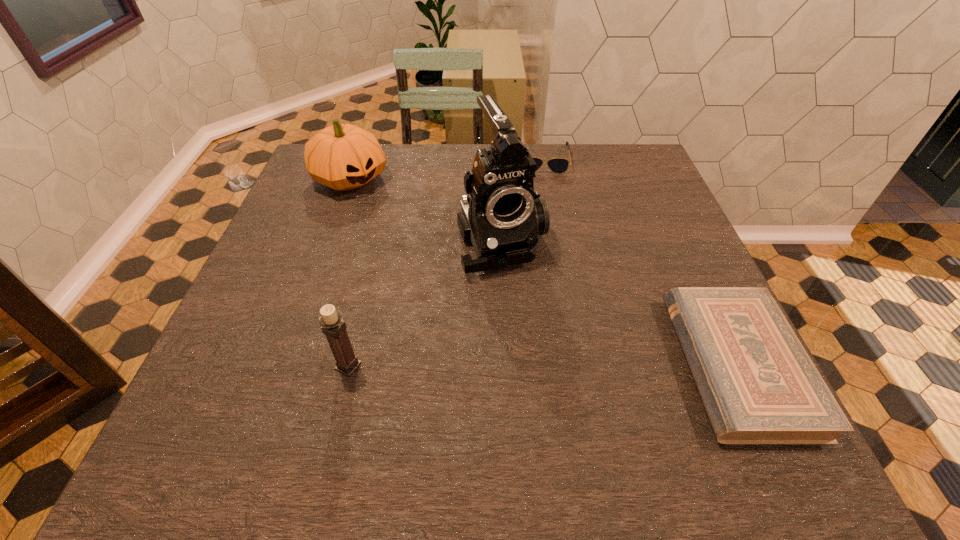
Locate an element on the screen. free spot on the desktop that is between the candle holder and the Bible and is positioned on the lens mount of the third farthest object is located at coordinates (562, 365).

Locate an element on the screen. The image size is (960, 540). free space on the desktop that is between the candle holder and the rightmost object and is positioned on the side of the gourd with the carved face is located at coordinates tap(561, 365).

The image size is (960, 540). Identify the location of vacant spot on the desktop that is between the candle holder and the rightmost object and is positioned on the front-facing side of the sunglasses. (555, 365).